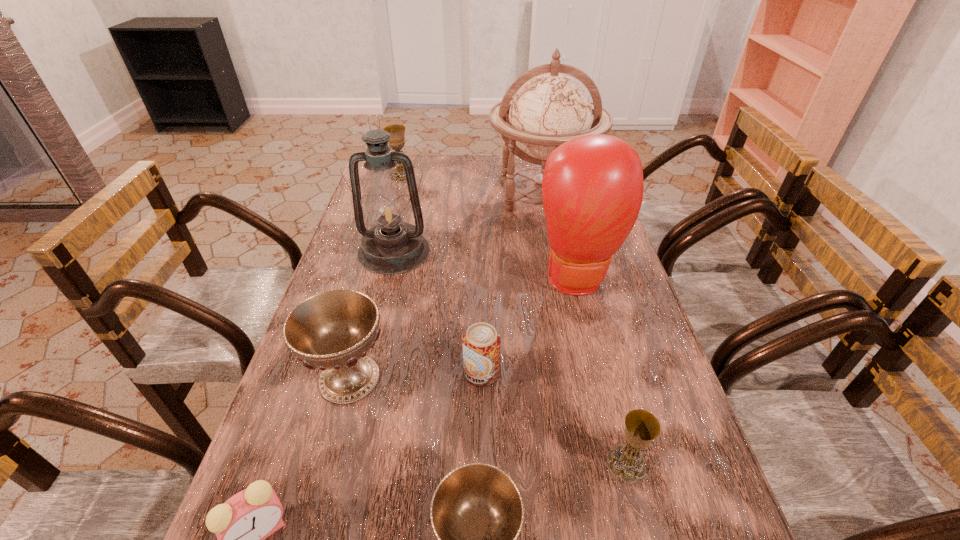
The image size is (960, 540). Identify the location of free space located on the front-facing side of the globe. pos(566,306).

Identify the location of free point located on the right of the oil lamp. This screenshot has width=960, height=540. [513, 251].

The height and width of the screenshot is (540, 960). Identify the location of vacant region located 0.110m on the striking surface of the boxing glove. (593, 341).

Locate an element on the screen. This screenshot has width=960, height=540. free point located on the right of the farthest chalice is located at coordinates [444, 176].

At what (x,y) coordinates should I click in order to perform the action: click on vacant position located on the back of the third nearest chalice. Please return your answer as a coordinate pair (x, y). Looking at the image, I should click on (386, 242).

You are a GUI agent. You are given a task and a screenshot of the screen. Output one action in this format:
    pyautogui.click(x=<x>, y=<y>)
    Task: Click on the free point located 0.070m on the back of the smaller gold chalice
    Image resolution: width=960 pixels, height=540 pixels.
    Given the screenshot: What is the action you would take?
    pyautogui.click(x=613, y=413)

Identify the location of free region located on the left of the beer can. Image resolution: width=960 pixels, height=540 pixels. (404, 373).

Image resolution: width=960 pixels, height=540 pixels. What are the coordinates of `globe located in the far edge section of the desktop` in the screenshot? It's located at (550, 109).

At what (x,y) coordinates should I click in order to perform the action: click on chalice that is at the far edge. Please return your answer as a coordinate pair (x, y). The width and height of the screenshot is (960, 540). Looking at the image, I should click on (397, 132).

Find the location of a particular element. The image size is (960, 540). oil lamp positioned at the left edge is located at coordinates (391, 247).